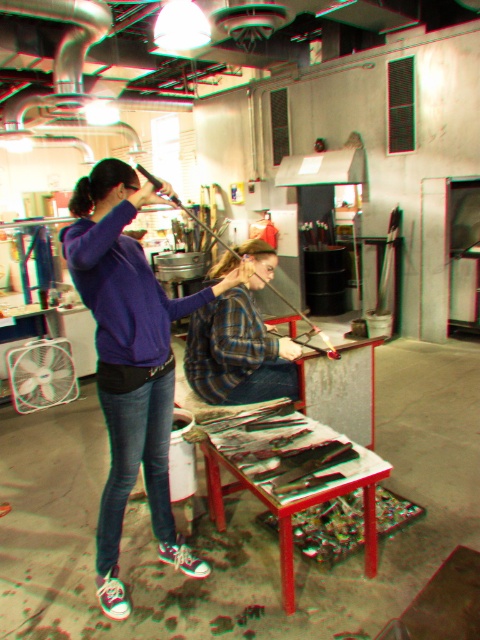
Can you confirm if wooden table at center is positioned below denim at center?

Yes, wooden table at center is below denim at center.

Is wooden table at center to the left of denim at center from the viewer's perspective?

No, wooden table at center is not to the left of denim at center.

I want to click on wooden table at center, so click(x=287, y=472).

Where is `wooden table at center`? The width and height of the screenshot is (480, 640). wooden table at center is located at coordinates (287, 472).

Between purple matte hoodie at upper left and wooden table at center, which one has more height?

Standing taller between the two is purple matte hoodie at upper left.

Is point (123, 436) farther from camera compared to point (254, 420)?

No.

This screenshot has width=480, height=640. What are the coordinates of `purple matte hoodie at upper left` in the screenshot? It's located at (130, 362).

How much distance is there between purple matte hoodie at upper left and denim jeans at center?

purple matte hoodie at upper left is 5.21 inches away from denim jeans at center.

Between purple matte hoodie at upper left and denim jeans at center, which one is positioned higher?

purple matte hoodie at upper left is higher up.

Between point (98, 337) and point (157, 420), which one is positioned behind?

Positioned behind is point (157, 420).

What are the coordinates of `purple matte hoodie at upper left` in the screenshot? It's located at (130, 362).